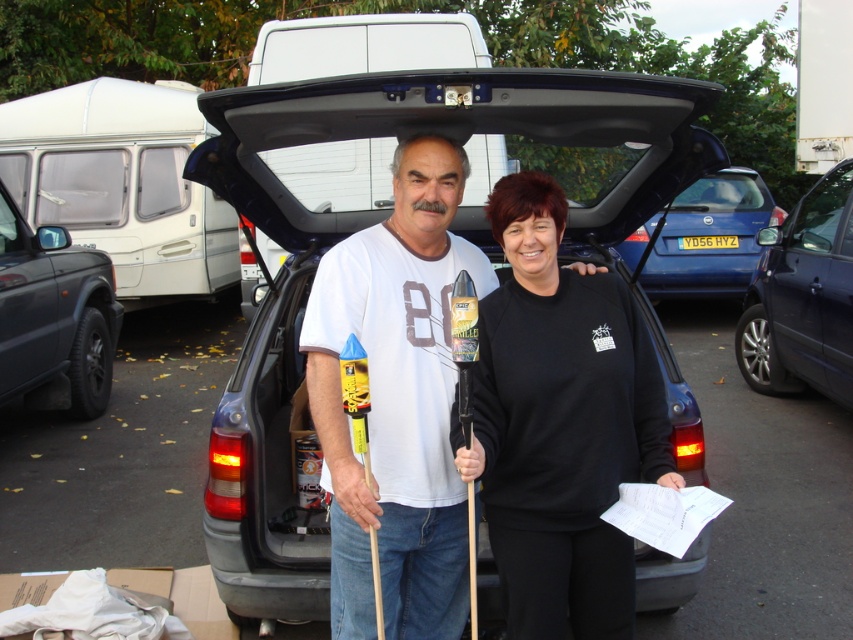
Between point (207, 227) and point (59, 240), which one is positioned behind?

The point (207, 227) is behind.

Measure the distance between point (144,291) and camera.

The distance of point (144,291) from camera is 8.73 meters.

Where is `white plastic van at upper left`? The width and height of the screenshot is (853, 640). white plastic van at upper left is located at coordinates (122, 182).

Does point (361, 163) come closer to viewer compared to point (729, 228)?

Yes, it is in front of point (729, 228).

Where is `white matte van at center`? white matte van at center is located at coordinates (364, 45).

Does metallic gray van at center have a lesser width compared to black matte sweatshirt at center?

In fact, metallic gray van at center might be wider than black matte sweatshirt at center.

This screenshot has height=640, width=853. What do you see at coordinates (383, 218) in the screenshot?
I see `metallic gray van at center` at bounding box center [383, 218].

You are a GUI agent. You are given a task and a screenshot of the screen. Output one action in this format:
    pyautogui.click(x=<x>, y=<y>)
    Task: Click on the metallic gray van at center
    
    Given the screenshot: What is the action you would take?
    pyautogui.click(x=383, y=218)